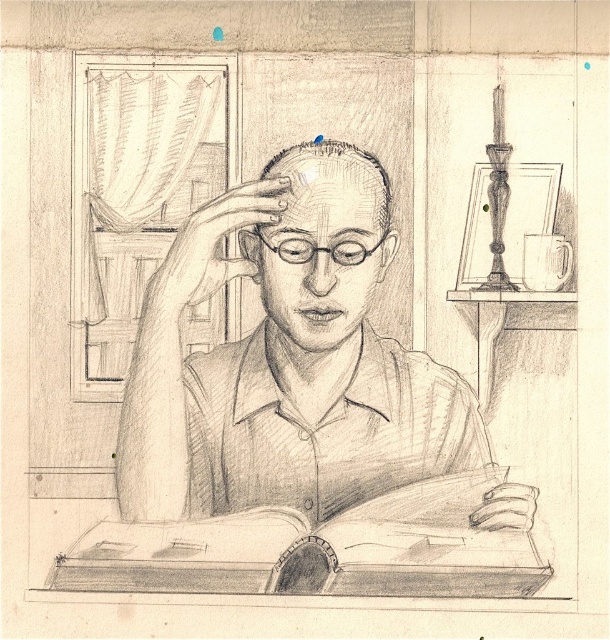
You are a student who needs to place both the smooth paper book at center and the white ceramic mug at upper right on a desk that can only hold items of equal size. Which item should you remove to ensure the other fits properly?

The smooth paper book at center is larger than the white ceramic mug at upper right, so you should remove the smooth paper book at center to make space for the mug if the desk requires equal sizes.